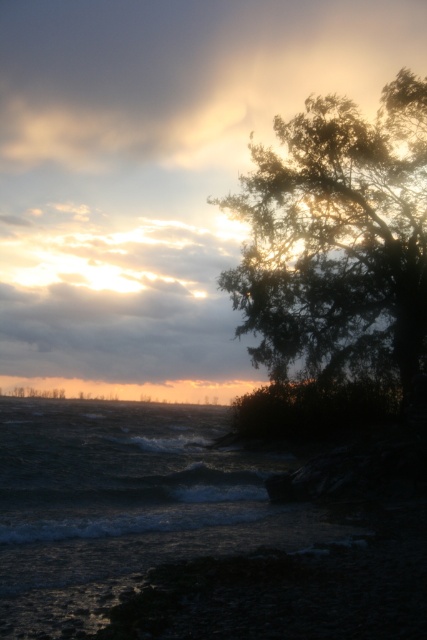
Question: Which point is farther to the camera?

Choices:
 (A) (81, 572)
 (B) (263, 356)

Answer: (B)

Question: In this image, where is dark gray water at lower left located relative to silhouette leafy tree at upper right?

Choices:
 (A) left
 (B) right

Answer: (A)

Question: Is the position of dark gray water at lower left more distant than that of silhouette leafy tree at upper right?

Choices:
 (A) yes
 (B) no

Answer: (B)

Question: Is dark gray water at lower left wider than silhouette leafy tree at upper right?

Choices:
 (A) yes
 (B) no

Answer: (B)